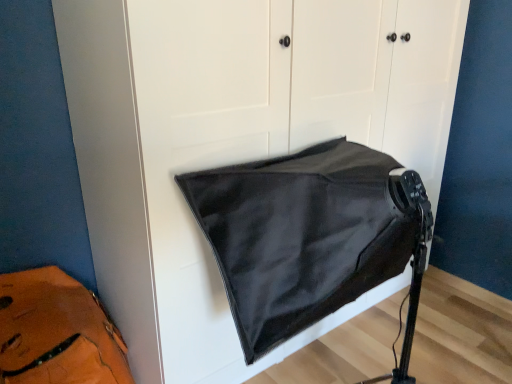
Question: Based on their positions, is black matte/satin sleeping bag at center located to the left or right of leather at left?

Choices:
 (A) right
 (B) left

Answer: (A)

Question: Considering the positions of point (355, 221) and point (40, 370), is point (355, 221) closer or farther from the camera than point (40, 370)?

Choices:
 (A) farther
 (B) closer

Answer: (B)

Question: Looking at their shapes, would you say black matte/satin sleeping bag at center is wider or thinner than leather at left?

Choices:
 (A) thin
 (B) wide

Answer: (B)

Question: Is leather at left in front of or behind black matte/satin sleeping bag at center in the image?

Choices:
 (A) behind
 (B) front

Answer: (A)

Question: From a real-world perspective, is leather at left physically located above or below black matte/satin sleeping bag at center?

Choices:
 (A) below
 (B) above

Answer: (A)

Question: From the image's perspective, is leather at left above or below black matte/satin sleeping bag at center?

Choices:
 (A) below
 (B) above

Answer: (A)

Question: Is leather at left spatially inside black matte/satin sleeping bag at center, or outside of it?

Choices:
 (A) outside
 (B) inside

Answer: (A)